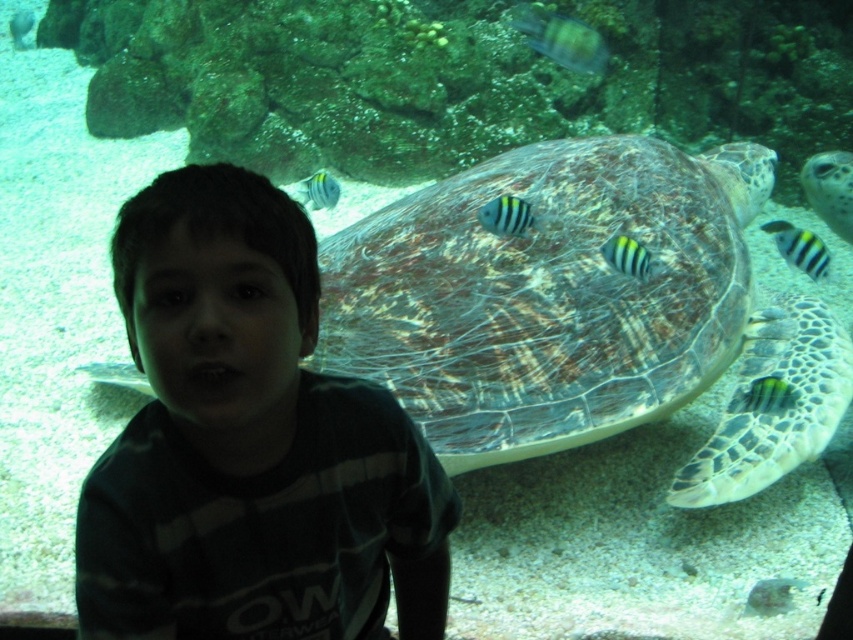
You are a visitor at the aquarium and see the dark green striped shirt at center and the striped fabric fish at center. Which object is positioned to the left from your perspective?

The dark green striped shirt at center is to the left of the striped fabric fish at center.

You are a marine biologist observing the aquarium. You notice the leathery green turtle at center and the striped matte fish at center. Which one has a greater height in this scene?

The leathery green turtle at center is taller than the striped matte fish at center according to the description.

You are an aquarium guide explaining the animals to a visitor. You mention the leathery green turtle at center and the striped matte fish at center. Which one is wider?

The leathery green turtle at center is wider than the striped matte fish at center.